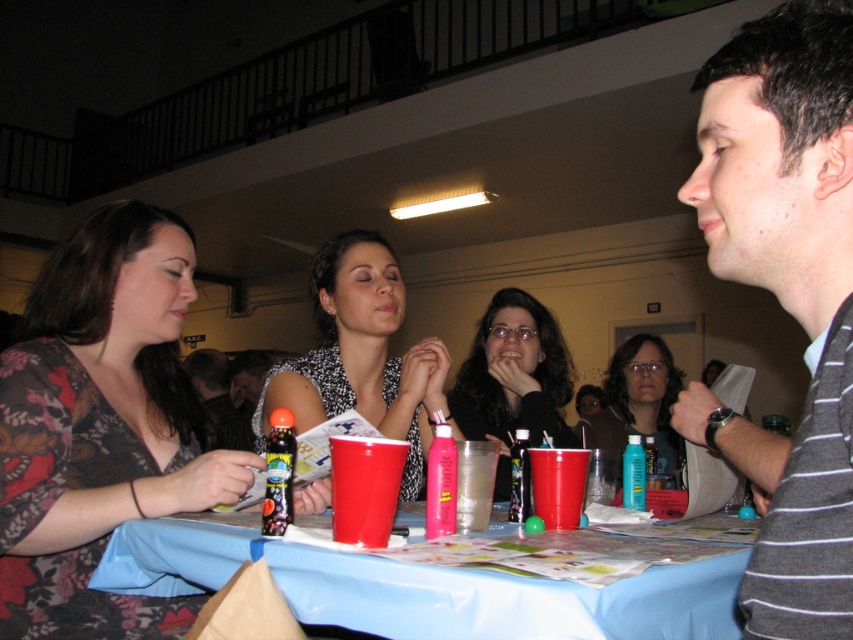
You are a guest at the party and want to grab the pink plastic cup at table center. Which side of the matte black dress at center should you approach from to reach the cup?

The pink plastic cup at table center is to the right of the matte black dress at center, so you should approach from the right side of the matte black dress at center to reach the cup.

You are a photographer at the event and want to capture a closeup of the matte black hair at center and the matte plastic cup at table center. Which object is wider so that it can be framed better in your shot?

The matte black hair at center is wider than the matte plastic cup at table center, so it can be framed better in the shot.

You are a guest at this party and want to place your pink plastic cup at table center on the table without covering the green ball. Given the size of the matte black dress at center, will there be enough space?

The matte black dress at center is larger in size than the pink plastic cup at table center. Since the dress is bigger, there should be sufficient space to place the cup near the center without covering the green ball.